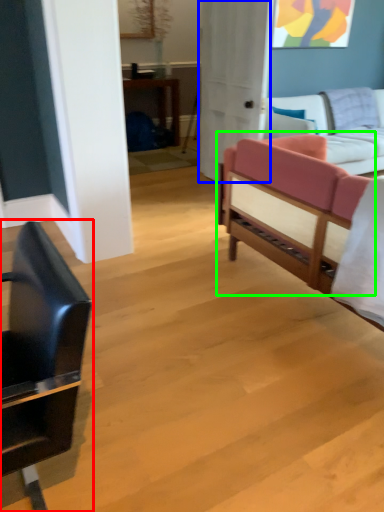
Question: Considering the real-world distances, which object is farthest from chair (highlighted by a red box)? glass door (highlighted by a blue box) or studio couch (highlighted by a green box)?

Choices:
 (A) glass door
 (B) studio couch

Answer: (A)